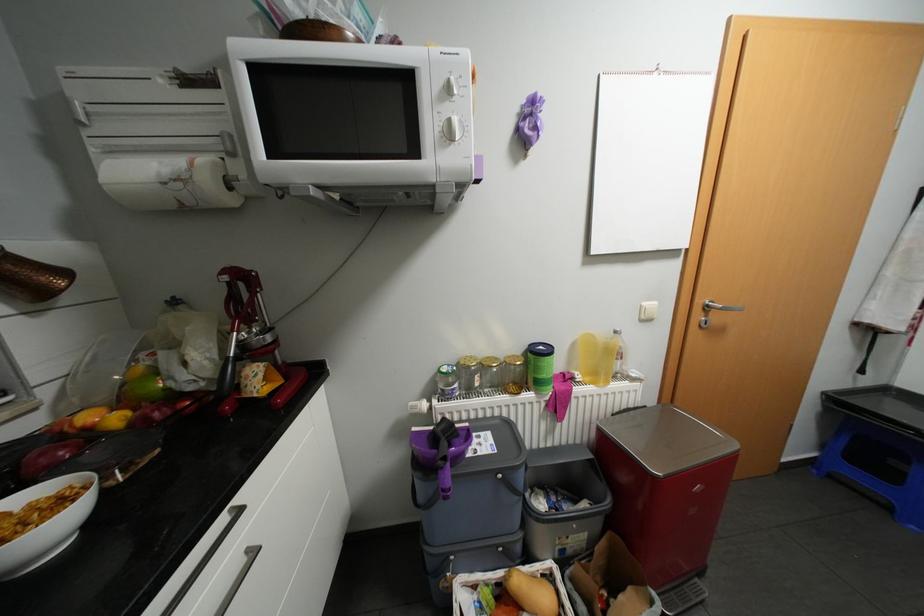
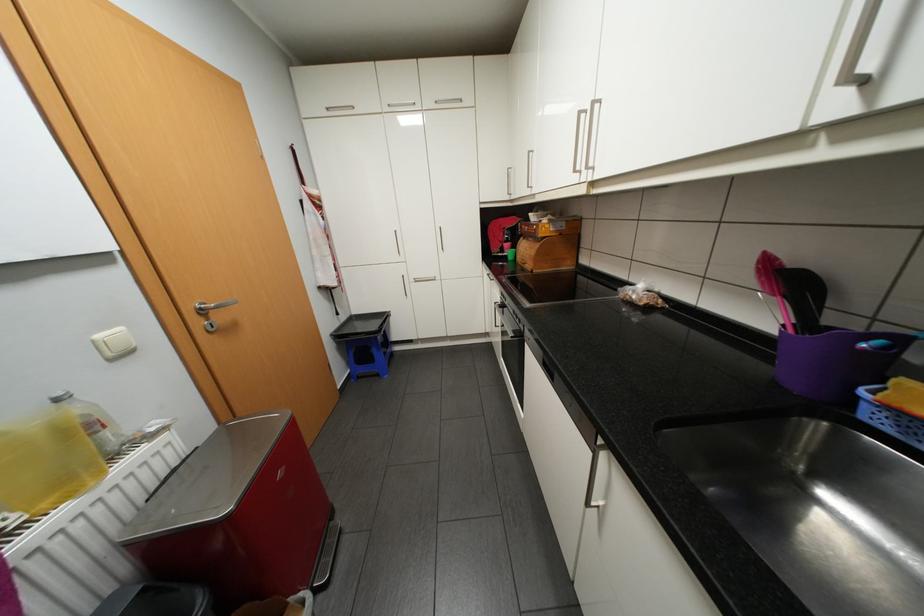
The point at (895, 507) is marked in the first image. Where is the corresponding point in the second image?

(385, 374)